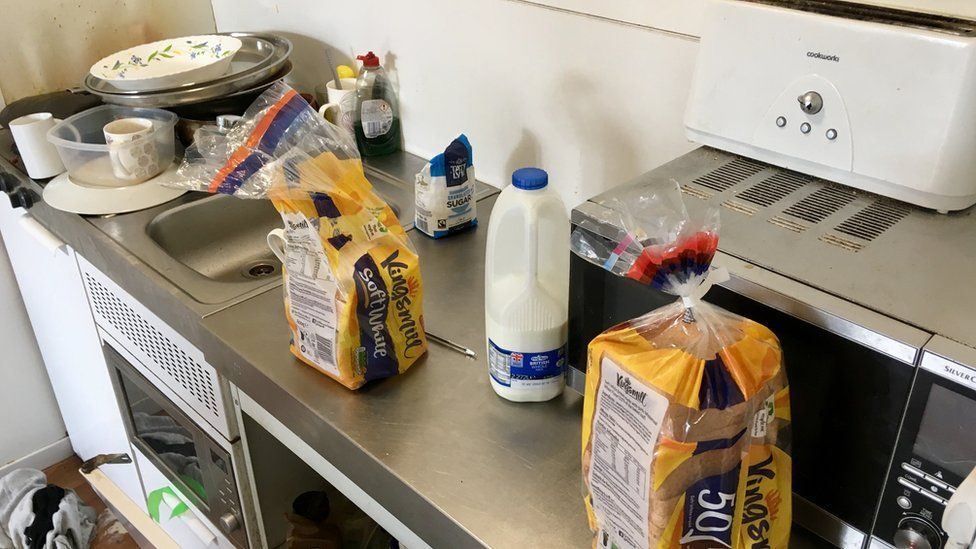
I want to click on microwave, so click(856, 386), click(834, 322), click(931, 434), click(584, 298).